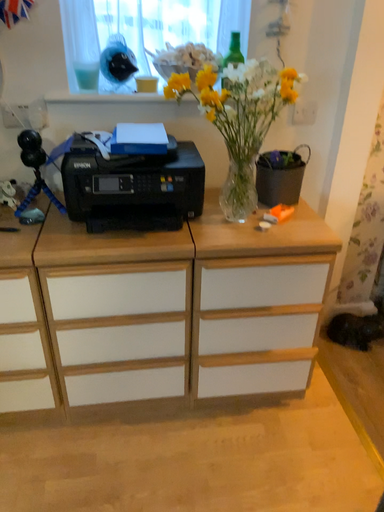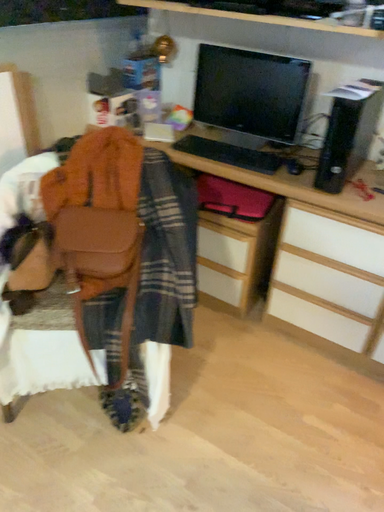
Question: How did the camera likely rotate when shooting the video?

Choices:
 (A) rotated right
 (B) rotated left

Answer: (B)